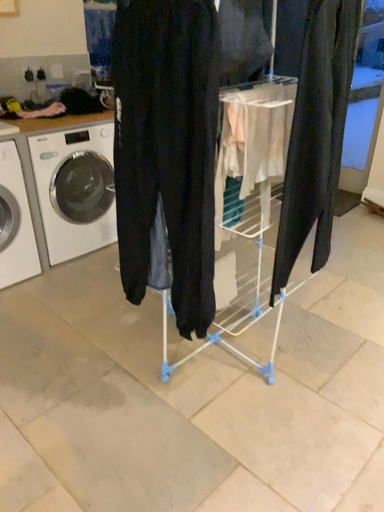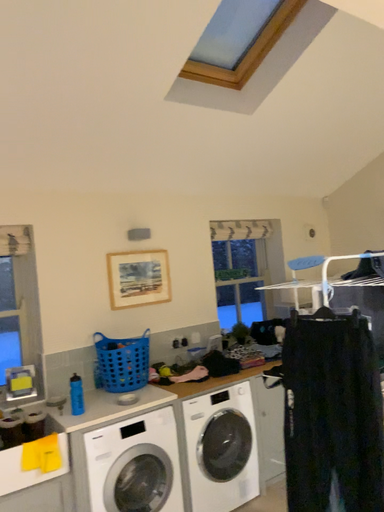
Question: How did the camera likely rotate when shooting the video?

Choices:
 (A) rotated left
 (B) rotated right

Answer: (A)